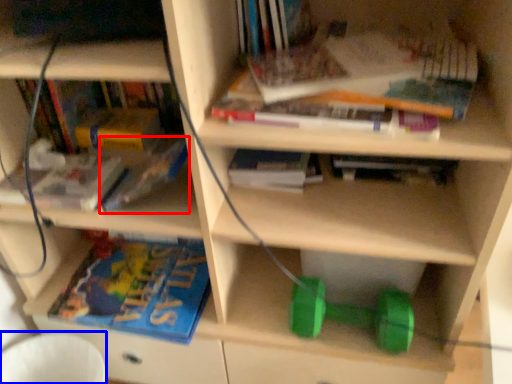
Question: Which point is closer to the camera, book (highlighted by a red box) or swivel chair (highlighted by a blue box)?

Choices:
 (A) book
 (B) swivel chair

Answer: (A)